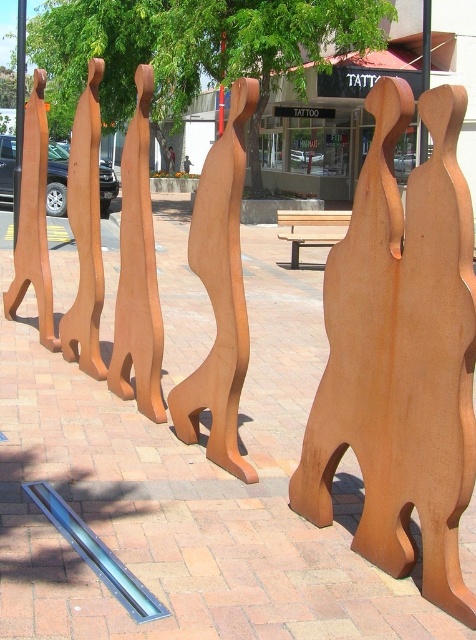
You are an art curator examining the row of sculptures. You notice two sculptures labeled as brown wood sculpture at center and brown wooden sculpture at center. Which one is taller?

The brown wood sculpture at center is taller than the brown wooden sculpture at center.

You are standing in front of the row of sculptures and want to touch the brown wood sculpture at center and the wooden sculpture at center. Which sculpture should you reach out to first to touch the one closer to you?

You should reach out to touch the brown wood sculpture at center first because it is closer to you than the wooden sculpture at center.

You are standing in front of the sculptures and want to sit down. Which object, the rusty metal bench at center or the brown wooden sculpture at center, is closer to you?

The rusty metal bench at center is closer to the viewer than the brown wooden sculpture at center, so you can sit on the rusty metal bench at center.